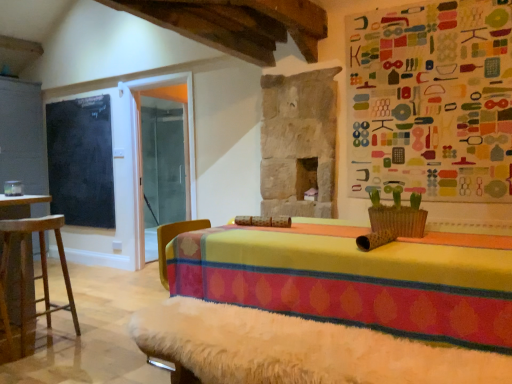
Question: Is black chalkboard at left taller or shorter than white fur-covered bench at lower center?

Choices:
 (A) short
 (B) tall

Answer: (B)

Question: Would you say black chalkboard at left is inside or outside white fur-covered bench at lower center?

Choices:
 (A) inside
 (B) outside

Answer: (B)

Question: Which of these objects is positioned farthest from the black chalkboard at left?

Choices:
 (A) white fur-covered bench at lower center
 (B) wooden stool at left

Answer: (A)

Question: Based on their relative distances, which object is farther from the black chalkboard at left?

Choices:
 (A) wooden stool at left
 (B) white fur-covered bench at lower center

Answer: (B)